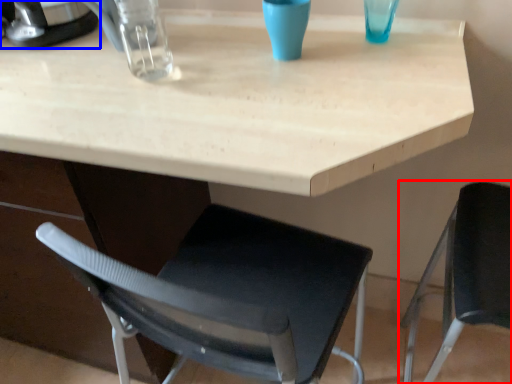
Question: Among these objects, which one is farthest to the camera, chair (highlighted by a red box) or appliance (highlighted by a blue box)?

Choices:
 (A) chair
 (B) appliance

Answer: (B)